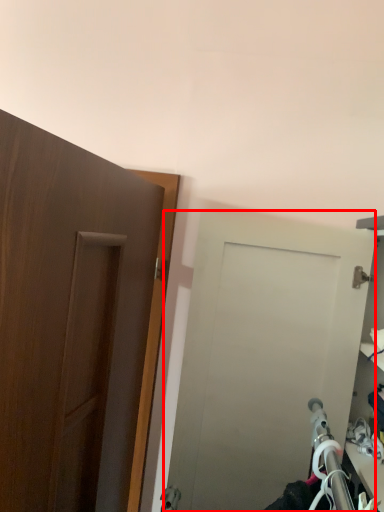
Question: From the image's perspective, what is the correct spatial positioning of door (annotated by the red box) in reference to door?

Choices:
 (A) below
 (B) above

Answer: (A)